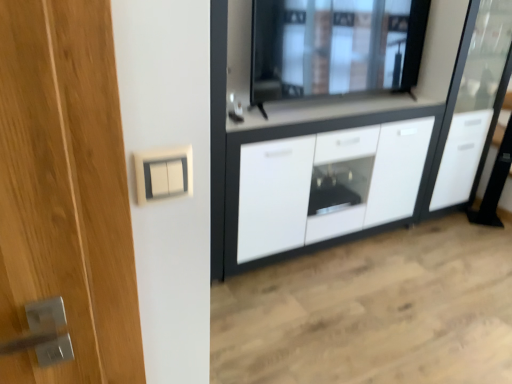
What do you see at coordinates (320, 188) in the screenshot? The image size is (512, 384). I see `white glossy cabinet at center` at bounding box center [320, 188].

The image size is (512, 384). I want to click on white glossy cabinet at center, so click(320, 188).

Image resolution: width=512 pixels, height=384 pixels. What do you see at coordinates (163, 174) in the screenshot?
I see `white plastic switch at upper center` at bounding box center [163, 174].

Describe the element at coordinates (472, 106) in the screenshot. This screenshot has height=384, width=512. I see `white glossy cabinet at right` at that location.

Identify the location of transparent glass window at upper center. (334, 47).

This screenshot has height=384, width=512. In order to click on white glossy cabinet at center in this screenshot , I will do `click(320, 188)`.

Considering the sizes of white glossy cabinet at right and white plastic switch at upper center in the image, is white glossy cabinet at right bigger or smaller than white plastic switch at upper center?

In the image, white glossy cabinet at right appears to be larger than white plastic switch at upper center.

Is point (447, 125) positioned before point (173, 164)?

No, (447, 125) is behind (173, 164).

Is white glossy cabinet at right to the left or to the right of white plastic switch at upper center in the image?

white glossy cabinet at right is to the right of white plastic switch at upper center.

Considering the points (482, 137) and (379, 223), which point is behind, point (482, 137) or point (379, 223)?

The point (482, 137) is behind.

Where is `screen door on the right of white glossy cabinet at center`? This screenshot has height=384, width=512. screen door on the right of white glossy cabinet at center is located at coordinates (472, 106).

From the image's perspective, is white glossy cabinet at center below transparent glass window at upper center?

Indeed, from the image's perspective, white glossy cabinet at center is shown beneath transparent glass window at upper center.

Considering the sizes of objects white glossy cabinet at center and transparent glass window at upper center in the image provided, who is smaller, white glossy cabinet at center or transparent glass window at upper center?

With smaller size is transparent glass window at upper center.

Can you see white glossy cabinet at center touching transparent glass window at upper center?

No, white glossy cabinet at center is not in contact with transparent glass window at upper center.

The image size is (512, 384). I want to click on window located above the white glossy cabinet at center (from a real-world perspective), so click(x=334, y=47).

Is white glossy cabinet at right not close to transparent glass window at upper center?

No, white glossy cabinet at right is not far away from transparent glass window at upper center.

What's the angular difference between white glossy cabinet at right and transparent glass window at upper center's facing directions?

0.208 degrees separate the facing orientations of white glossy cabinet at right and transparent glass window at upper center.

At what (x,y) coordinates should I click in order to perform the action: click on window above the white glossy cabinet at right (from a real-world perspective). Please return your answer as a coordinate pair (x, y). The height and width of the screenshot is (384, 512). Looking at the image, I should click on (334, 47).

Can you confirm if white glossy cabinet at right is wider than transparent glass window at upper center?

Correct, the width of white glossy cabinet at right exceeds that of transparent glass window at upper center.

This screenshot has height=384, width=512. What are the coordinates of `electric outlet below the transparent glass window at upper center (from the image's perspective)` in the screenshot? It's located at click(x=163, y=174).

Which object is further away from the camera taking this photo, transparent glass window at upper center or white plastic switch at upper center?

transparent glass window at upper center is further away from the camera.

Looking at this image, is transparent glass window at upper center in contact with white plastic switch at upper center?

No, transparent glass window at upper center is not making contact with white plastic switch at upper center.

Considering the relative sizes of white plastic switch at upper center and transparent glass window at upper center in the image provided, is white plastic switch at upper center thinner than transparent glass window at upper center?

Yes, white plastic switch at upper center is thinner than transparent glass window at upper center.

From a real-world perspective, is white plastic switch at upper center positioned above or below transparent glass window at upper center?

Clearly, from a real-world perspective, white plastic switch at upper center is above transparent glass window at upper center.

Which of these two, white plastic switch at upper center or transparent glass window at upper center, is smaller?

white plastic switch at upper center is smaller.

At what (x,y) coordinates should I click in order to perform the action: click on electric outlet located in front of the transparent glass window at upper center. Please return your answer as a coordinate pair (x, y). This screenshot has width=512, height=384. Looking at the image, I should click on (163, 174).

Which object is positioned more to the right, transparent glass window at upper center or white glossy cabinet at center?

Positioned to the right is transparent glass window at upper center.

From a real-world perspective, who is located higher, transparent glass window at upper center or white glossy cabinet at center?

transparent glass window at upper center.

Is transparent glass window at upper center placed right next to white glossy cabinet at center?

No, transparent glass window at upper center is not making contact with white glossy cabinet at center.

Looking at this image, can you tell me how much transparent glass window at upper center and white glossy cabinet at center differ in facing direction?

They differ by 0.208 degrees in their facing directions.

The height and width of the screenshot is (384, 512). What are the coordinates of `electric outlet on the left of white glossy cabinet at right` in the screenshot? It's located at (163, 174).

In order to click on screen door behind the white glossy cabinet at center in this screenshot , I will do `click(472, 106)`.

When comparing their distances from white glossy cabinet at right, does transparent glass window at upper center or white glossy cabinet at center seem closer?

Among the two, transparent glass window at upper center is located nearer to white glossy cabinet at right.

From the image, which object appears to be nearer to white glossy cabinet at right, transparent glass window at upper center or white plastic switch at upper center?

Based on the image, transparent glass window at upper center appears to be nearer to white glossy cabinet at right.

When comparing their distances from white glossy cabinet at center, does transparent glass window at upper center or white glossy cabinet at right seem closer?

Among the two, transparent glass window at upper center is located nearer to white glossy cabinet at center.

From the picture: Which object lies further to the anchor point white plastic switch at upper center, white glossy cabinet at right or white glossy cabinet at center?

Among the two, white glossy cabinet at right is located further to white plastic switch at upper center.

When comparing their distances from white glossy cabinet at right, does white glossy cabinet at center or transparent glass window at upper center seem further?

white glossy cabinet at center lies further to white glossy cabinet at right than the other object.

Considering their positions, is white glossy cabinet at center positioned further to transparent glass window at upper center than white glossy cabinet at right?

Among the two, white glossy cabinet at right is located further to transparent glass window at upper center.

From the image, which object appears to be farther from white glossy cabinet at center, white plastic switch at upper center or white glossy cabinet at right?

white plastic switch at upper center is positioned further to the anchor white glossy cabinet at center.

Considering their positions, is white plastic switch at upper center positioned closer to white glossy cabinet at right than transparent glass window at upper center?

transparent glass window at upper center is closer to white glossy cabinet at right.

The image size is (512, 384). In order to click on cabinetry positioned between white plastic switch at upper center and white glossy cabinet at right from near to far in this screenshot , I will do `click(320, 188)`.

Identify the location of window positioned between white plastic switch at upper center and white glossy cabinet at center from near to far. (334, 47).

Image resolution: width=512 pixels, height=384 pixels. I want to click on window between white plastic switch at upper center and white glossy cabinet at right in the front-back direction, so click(x=334, y=47).

Where is `window between white glossy cabinet at center and white glossy cabinet at right from left to right`? This screenshot has height=384, width=512. window between white glossy cabinet at center and white glossy cabinet at right from left to right is located at coordinates (334, 47).